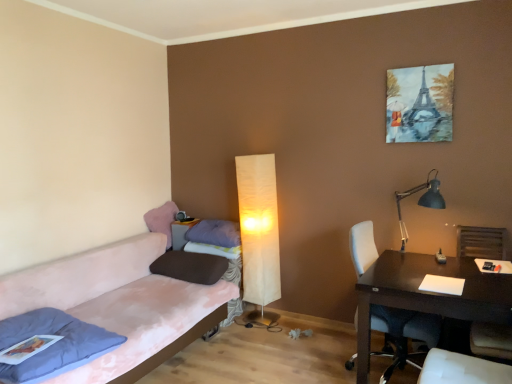
This screenshot has width=512, height=384. Identify the location of white leather chair at right. (403, 334).

Image resolution: width=512 pixels, height=384 pixels. Identify the location of blue fabric pillow at lower left, which is the fourth pillow in back-to-front order. (53, 344).

What is the approximate height of matte gray side table at lower left?

12.27 inches.

Locate an element on the screen. Image resolution: width=512 pixels, height=384 pixels. brown matte pillow at center, which is the 3th pillow in back-to-front order is located at coordinates (190, 267).

Where is `white leather chair at right`? white leather chair at right is located at coordinates (403, 334).

Can you confirm if matte gray side table at lower left is shorter than pink fabric couch at left?

Correct, matte gray side table at lower left is not as tall as pink fabric couch at left.

Considering the sizes of objects matte gray side table at lower left and pink fabric couch at left in the image provided, who is bigger, matte gray side table at lower left or pink fabric couch at left?

→ Bigger between the two is pink fabric couch at left.

Relative to pink fabric couch at left, is matte gray side table at lower left in front or behind?

In the image, matte gray side table at lower left appears behind pink fabric couch at left.

From a real-world perspective, is matte gray side table at lower left positioned over pink fabric couch at left based on gravity?

Yes, from a real-world perspective, matte gray side table at lower left is above pink fabric couch at left.

Does pink fabric pillow at upper left, placed as the first pillow when sorted from back to front, have a greater width compared to matte cream floor lamp at center, placed as the 2th lamp when sorted from right to left?

Yes, pink fabric pillow at upper left, placed as the first pillow when sorted from back to front, is wider than matte cream floor lamp at center, placed as the 2th lamp when sorted from right to left.

Is white leather armchair at right directly adjacent to white leather chair at right?

They are not placed beside each other.

Which is behind, white leather armchair at right or white leather chair at right?

white leather armchair at right is behind.

Which of these two, white leather armchair at right or white leather chair at right, stands taller?

Standing taller between the two is white leather chair at right.

Considering the sizes of acrylic painting of eiffel tower at upper right and pink fabric couch at left in the image, is acrylic painting of eiffel tower at upper right wider or thinner than pink fabric couch at left?

In the image, acrylic painting of eiffel tower at upper right appears to be more narrow than pink fabric couch at left.

Could pink fabric couch at left be considered to be inside acrylic painting of eiffel tower at upper right?

That's incorrect, pink fabric couch at left is not inside acrylic painting of eiffel tower at upper right.

Is acrylic painting of eiffel tower at upper right next to pink fabric couch at left?

acrylic painting of eiffel tower at upper right and pink fabric couch at left are clearly separated.

Is white leather armchair at right next to blue fabric pillow at lower left, which is the fourth pillow in back-to-front order?

No, white leather armchair at right is not with blue fabric pillow at lower left, which is the fourth pillow in back-to-front order.

At what (x,y) coordinates should I click in order to perform the action: click on the 4th pillow to the left of the white leather armchair at right, starting your count from the anchor. Please return your answer as a coordinate pair (x, y). Looking at the image, I should click on (53, 344).

Looking at this image, is white leather armchair at right positioned with its back to blue fabric pillow at lower left, the first pillow in the front-to-back sequence?

No.

Considering the positions of objects white leather armchair at right and blue fabric pillow at lower left, which is the fourth pillow in back-to-front order, in the image provided, who is behind, white leather armchair at right or blue fabric pillow at lower left, which is the fourth pillow in back-to-front order,?

white leather armchair at right is more distant.

Is acrylic painting of eiffel tower at upper right taller or shorter than blue fabric pillow at lower left, which is the fourth pillow in back-to-front order?

acrylic painting of eiffel tower at upper right is taller than blue fabric pillow at lower left, which is the fourth pillow in back-to-front order.

Is acrylic painting of eiffel tower at upper right not inside blue fabric pillow at lower left, the first pillow in the front-to-back sequence?

Absolutely, acrylic painting of eiffel tower at upper right is external to blue fabric pillow at lower left, the first pillow in the front-to-back sequence.

Does point (448, 82) appear closer or farther from the camera than point (59, 374)?

Point (448, 82).

From the image's perspective, which one is positioned lower, acrylic painting of eiffel tower at upper right or blue fabric pillow at lower left, which is the fourth pillow in back-to-front order?

blue fabric pillow at lower left, which is the fourth pillow in back-to-front order, appears lower in the image.

From the picture: Between dark wood desk at right and matte cream floor lamp at center, which ranks as the 1th lamp in back-to-front order, which one is positioned in front?

dark wood desk at right is more forward.

Is dark wood desk at right not near matte cream floor lamp at center, which is the first lamp in left-to-right order?

Yes, dark wood desk at right is far from matte cream floor lamp at center, which is the first lamp in left-to-right order.

In the image, there is a matte cream floor lamp at center, which ranks as the 1th lamp in back-to-front order. In order to click on table below it (from the image's perspective) in this screenshot , I will do `click(426, 294)`.

Locate an element on the screen. studio couch below the matte gray side table at lower left (from the image's perspective) is located at coordinates (115, 300).

The image size is (512, 384). I want to click on lamp that appears below the pink fabric pillow at upper left, placed as the first pillow when sorted from back to front (from a real-world perspective), so click(x=259, y=230).

From the picture: Estimate the real-world distances between objects in this image. Which object is further from dark wood desk at right, acrylic painting of eiffel tower at upper right or brown matte pillow at center, which is the 3th pillow in back-to-front order?

brown matte pillow at center, which is the 3th pillow in back-to-front order.

Which object lies further to the anchor point blue matte desk lamp at right, which appears as the first lamp when viewed from the front, blue fabric pillow at lower left, which is the fourth pillow in back-to-front order, or dark wood desk at right?

blue fabric pillow at lower left, which is the fourth pillow in back-to-front order, lies further to blue matte desk lamp at right, which appears as the first lamp when viewed from the front, than the other object.

From the image, which object appears to be farther from blue fabric pillow at lower left, which is the fourth pillow in back-to-front order, pink fabric pillow at upper left, placed as the first pillow when sorted from back to front, or pink fabric couch at left?

pink fabric pillow at upper left, placed as the first pillow when sorted from back to front, is positioned further to the anchor blue fabric pillow at lower left, which is the fourth pillow in back-to-front order.

Looking at the image, which one is located closer to matte gray side table at lower left, purple soft pillow at center, which ranks as the 2th pillow in back-to-front order, or dark wood desk at right?

The object closer to matte gray side table at lower left is purple soft pillow at center, which ranks as the 2th pillow in back-to-front order.

Based on their spatial positions, is purple soft pillow at center, which ranks as the 2th pillow in back-to-front order, or pink fabric couch at left further from blue fabric pillow at lower left, the first pillow in the front-to-back sequence?

Among the two, purple soft pillow at center, which ranks as the 2th pillow in back-to-front order, is located further to blue fabric pillow at lower left, the first pillow in the front-to-back sequence.

Estimate the real-world distances between objects in this image. Which object is closer to white leather armchair at right, matte cream floor lamp at center, the 2th lamp positioned from the front, or blue fabric pillow at lower left, which is the fourth pillow in back-to-front order?

The object closer to white leather armchair at right is matte cream floor lamp at center, the 2th lamp positioned from the front.

Based on their spatial positions, is blue fabric pillow at lower left, which is the fourth pillow in back-to-front order, or blue matte desk lamp at right, which is the 2th lamp from back to front, closer to brown matte pillow at center, which is the 3th pillow in back-to-front order?

blue fabric pillow at lower left, which is the fourth pillow in back-to-front order, is closer to brown matte pillow at center, which is the 3th pillow in back-to-front order.

When comparing their distances from dark wood desk at right, does blue fabric pillow at lower left, the first pillow in the front-to-back sequence, or pink fabric couch at left seem closer?

Among the two, pink fabric couch at left is located nearer to dark wood desk at right.

At what (x,y) coordinates should I click in order to perform the action: click on chair that lies between acrylic painting of eiffel tower at upper right and dark wood desk at right from top to bottom. Please return your answer as a coordinate pair (x, y). The width and height of the screenshot is (512, 384). Looking at the image, I should click on (403, 334).

You are a GUI agent. You are given a task and a screenshot of the screen. Output one action in this format:
    pyautogui.click(x=<x>, y=<y>)
    Task: Click on the pillow situated between brown matte pillow at center, which is counted as the second pillow, starting from the front, and dark wood desk at right from left to right
    The image size is (512, 384).
    Given the screenshot: What is the action you would take?
    pyautogui.click(x=215, y=233)

You are a GUI agent. You are given a task and a screenshot of the screen. Output one action in this format:
    pyautogui.click(x=<x>, y=<y>)
    Task: Click on the lamp located between brown matte pillow at center, which is the 3th pillow in back-to-front order, and blue matte desk lamp at right, the first lamp in the right-to-left sequence, in the left-right direction
    Image resolution: width=512 pixels, height=384 pixels.
    Given the screenshot: What is the action you would take?
    pyautogui.click(x=259, y=230)

Image resolution: width=512 pixels, height=384 pixels. I want to click on studio couch located between blue fabric pillow at lower left, which is the fourth pillow in back-to-front order, and acrylic painting of eiffel tower at upper right in the left-right direction, so click(115, 300).